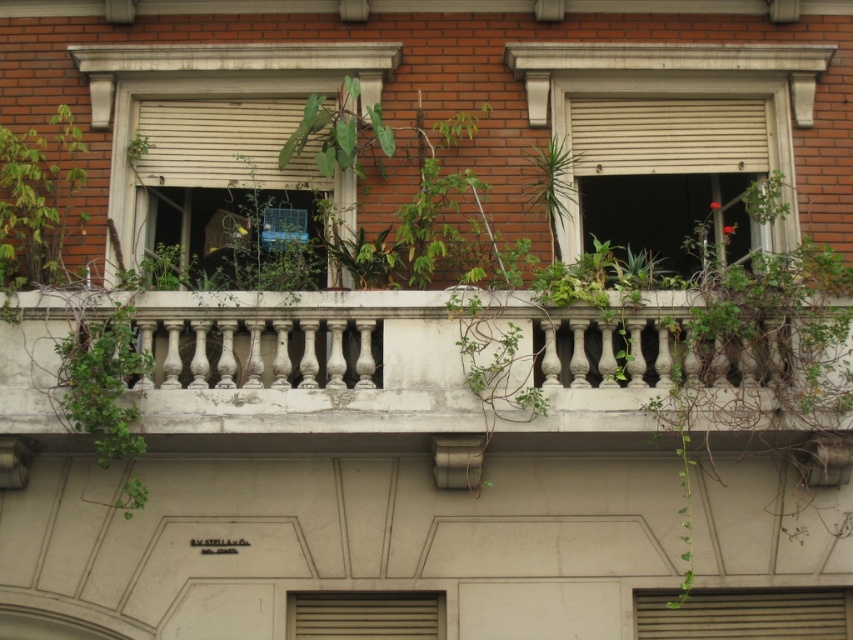
You are standing in front of the building and want to install a new decorative light between the white stone railing at center and the matte gray vent at center. Based on their positions, where should the light be placed?

The white stone railing at center is above the matte gray vent at center, so the light should be placed between them, below the white stone railing at center and above the matte gray vent at center.